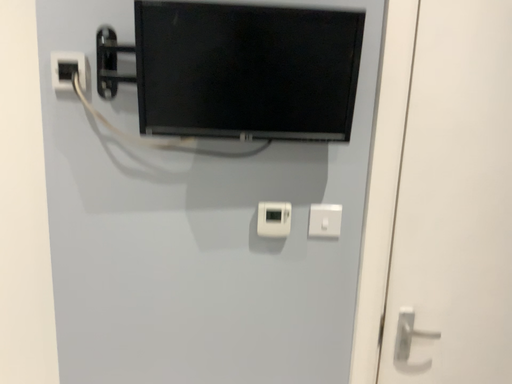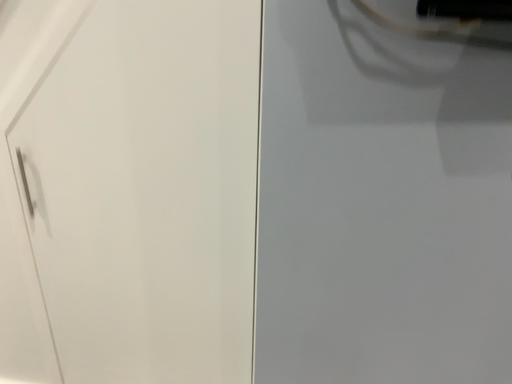
Question: Which way did the camera rotate in the video?

Choices:
 (A) rotated right
 (B) rotated left

Answer: (B)